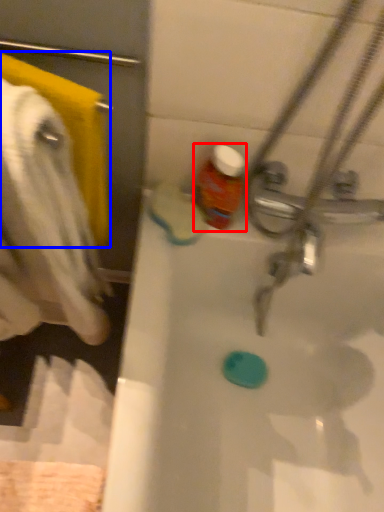
Question: Which point is further to the camera, bottle (highlighted by a red box) or towel/napkin (highlighted by a blue box)?

Choices:
 (A) bottle
 (B) towel/napkin

Answer: (A)